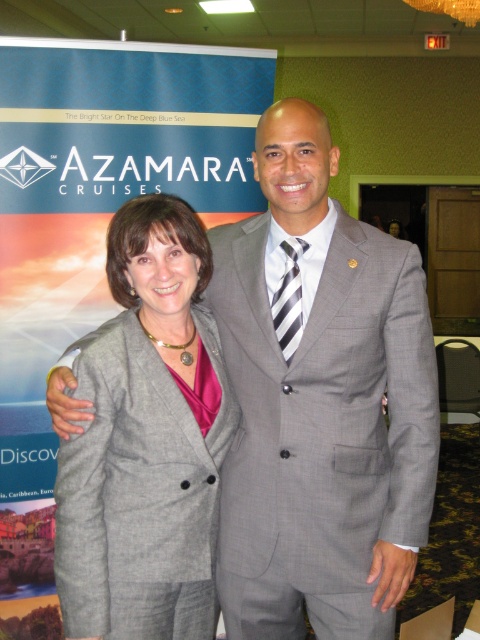
Is gray textured suit at center closer to camera compared to gray wool suit at center?

No, gray textured suit at center is further to the viewer.

Can you confirm if gray textured suit at center is wider than gray wool suit at center?

Indeed, gray textured suit at center has a greater width compared to gray wool suit at center.

What do you see at coordinates (320, 401) in the screenshot? I see `gray textured suit at center` at bounding box center [320, 401].

Identify the location of gray textured suit at center. click(320, 401).